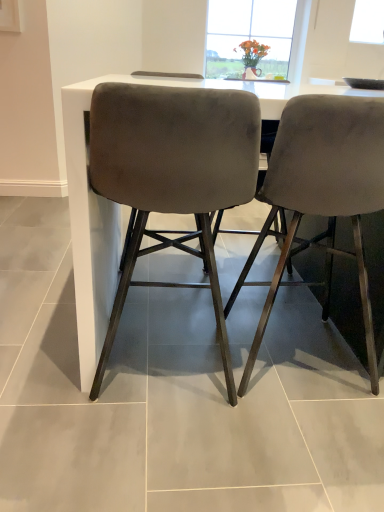
Question: In the image, is velvet grey chair at right, the first chair positioned from the right, positioned in front of or behind suede-like gray chair at center, the first chair when ordered from left to right?

Choices:
 (A) behind
 (B) front

Answer: (A)

Question: Considering the positions of velvet grey chair at right, the first chair positioned from the right, and suede-like gray chair at center, which is counted as the 2th chair, starting from the right, in the image, is velvet grey chair at right, the first chair positioned from the right, wider or thinner than suede-like gray chair at center, which is counted as the 2th chair, starting from the right,?

Choices:
 (A) thin
 (B) wide

Answer: (B)

Question: Is point (380, 134) closer or farther from the camera than point (112, 91)?

Choices:
 (A) farther
 (B) closer

Answer: (A)

Question: Looking at the image, does suede-like gray chair at center, which is counted as the 2th chair, starting from the right, seem bigger or smaller compared to velvet grey chair at right, the first chair positioned from the right?

Choices:
 (A) small
 (B) big

Answer: (A)

Question: From the image's perspective, is suede-like gray chair at center, which is counted as the 2th chair, starting from the right, located above or below velvet grey chair at right, the first chair positioned from the right?

Choices:
 (A) below
 (B) above

Answer: (A)

Question: Would you say suede-like gray chair at center, the first chair when ordered from left to right, is inside or outside velvet grey chair at right, which ranks as the second chair in left-to-right order?

Choices:
 (A) inside
 (B) outside

Answer: (B)

Question: In terms of height, does suede-like gray chair at center, the first chair when ordered from left to right, look taller or shorter compared to velvet grey chair at right, which ranks as the second chair in left-to-right order?

Choices:
 (A) short
 (B) tall

Answer: (A)